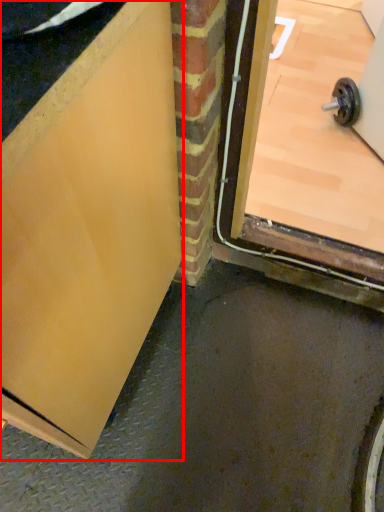
Question: Where is door (annotated by the red box) located in relation to door in the image?

Choices:
 (A) left
 (B) right

Answer: (A)